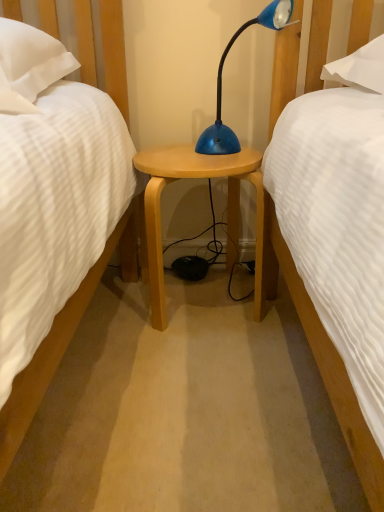
The image size is (384, 512). Find the location of `light wood/finishednightstand at center`. light wood/finishednightstand at center is located at coordinates (227, 215).

Describe the element at coordinates (227, 215) in the screenshot. I see `light wood/finishednightstand at center` at that location.

Locate an element on the screen. Image resolution: width=384 pixels, height=512 pixels. blue plastic lamp at center is located at coordinates (221, 81).

What do you see at coordinates (221, 81) in the screenshot?
I see `blue plastic lamp at center` at bounding box center [221, 81].

Find the location of a particular element. The height and width of the screenshot is (512, 384). light wood/finishednightstand at center is located at coordinates (227, 215).

Which object is positioned more to the right, blue plastic lamp at center or light wood/finishednightstand at center?

blue plastic lamp at center.

Does blue plastic lamp at center come behind light wood/finishednightstand at center?

No, it is in front of light wood/finishednightstand at center.

Which point is more distant from viewer, [285,13] or [146,201]?

The point [146,201] is more distant.

From the image's perspective, is blue plastic lamp at center located above or below light wood/finishednightstand at center?

From the image's perspective, blue plastic lamp at center appears above light wood/finishednightstand at center.

From a real-world perspective, which is physically above, blue plastic lamp at center or light wood/finishednightstand at center?

blue plastic lamp at center.

Is blue plastic lamp at center thinner than light wood/finishednightstand at center?

Yes.

Considering the sizes of objects blue plastic lamp at center and light wood/finishednightstand at center in the image provided, who is taller, blue plastic lamp at center or light wood/finishednightstand at center?

light wood/finishednightstand at center is taller.

Is blue plastic lamp at center bigger than light wood/finishednightstand at center?

Incorrect, blue plastic lamp at center is not larger than light wood/finishednightstand at center.

Is blue plastic lamp at center inside the boundaries of light wood/finishednightstand at center, or outside?

blue plastic lamp at center exists outside the volume of light wood/finishednightstand at center.

Are blue plastic lamp at center and light wood/finishednightstand at center making contact?

No.

Could you tell me if blue plastic lamp at center is turned towards light wood/finishednightstand at center?

No, blue plastic lamp at center is not facing towards light wood/finishednightstand at center.

How much distance is there between blue plastic lamp at center and light wood/finishednightstand at center?

blue plastic lamp at center is 7.61 inches away from light wood/finishednightstand at center.

Find the location of a particular element. This screenshot has height=512, width=384. lamp on the right side of light wood/finishednightstand at center is located at coordinates (221, 81).

Can you confirm if light wood/finishednightstand at center is positioned to the right of blue plastic lamp at center?

In fact, light wood/finishednightstand at center is to the left of blue plastic lamp at center.

Which object is more forward, light wood/finishednightstand at center or blue plastic lamp at center?

Positioned in front is blue plastic lamp at center.

Does point (262, 292) come behind point (269, 23)?

No.

From the image's perspective, which object appears higher, light wood/finishednightstand at center or blue plastic lamp at center?

blue plastic lamp at center is shown above in the image.

From a real-world perspective, is light wood/finishednightstand at center on blue plastic lamp at center?

No, from a real-world perspective, light wood/finishednightstand at center is not above blue plastic lamp at center.

Which object is wider, light wood/finishednightstand at center or blue plastic lamp at center?

Wider between the two is light wood/finishednightstand at center.

Can you confirm if light wood/finishednightstand at center is shorter than blue plastic lamp at center?

In fact, light wood/finishednightstand at center may be taller than blue plastic lamp at center.

Is light wood/finishednightstand at center smaller than blue plastic lamp at center?

Incorrect, light wood/finishednightstand at center is not smaller in size than blue plastic lamp at center.

Is light wood/finishednightstand at center surrounding blue plastic lamp at center?

No, blue plastic lamp at center is located outside of light wood/finishednightstand at center.

Is light wood/finishednightstand at center not near blue plastic lamp at center?

No, light wood/finishednightstand at center is in close proximity to blue plastic lamp at center.

Could you tell me if light wood/finishednightstand at center is facing blue plastic lamp at center?

No, light wood/finishednightstand at center is not turned towards blue plastic lamp at center.

How different are the orientations of light wood/finishednightstand at center and blue plastic lamp at center in degrees?

They differ by 52.2 degrees in their facing directions.

Identify the location of lamp in front of the light wood/finishednightstand at center. (221, 81).

Locate an element on the screen. This screenshot has width=384, height=512. nightstand on the left of blue plastic lamp at center is located at coordinates (227, 215).

The image size is (384, 512). In order to click on nightstand below the blue plastic lamp at center (from a real-world perspective) in this screenshot , I will do `click(227, 215)`.